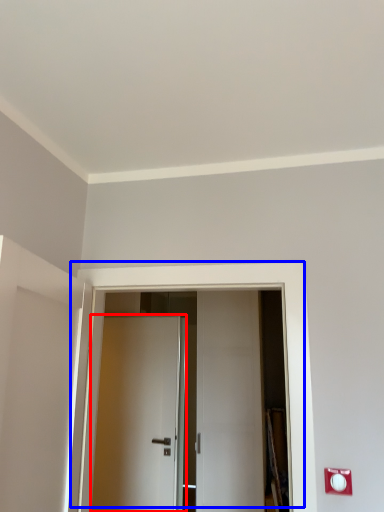
Question: Which of the following is the farthest to the observer, door (highlighted by a red box) or door (highlighted by a blue box)?

Choices:
 (A) door
 (B) door

Answer: (A)